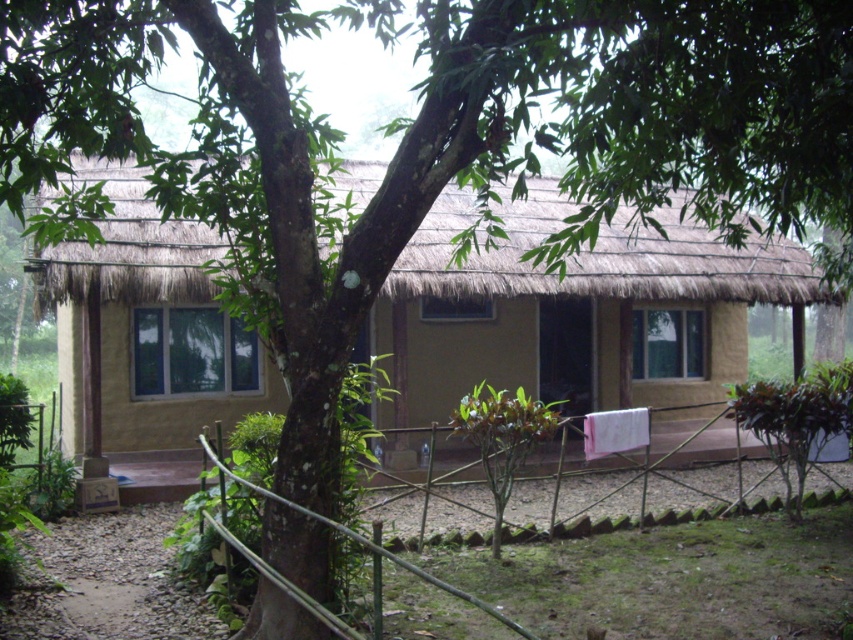
Is beige clay hut at center bigger than bamboo fence at lower center?

Yes.

Based on the photo, does beige clay hut at center have a lesser height compared to bamboo fence at lower center?

Incorrect, beige clay hut at center's height does not fall short of bamboo fence at lower center's.

Is point (117, 284) in front of point (506, 621)?

No.

At what (x,y) coordinates should I click in order to perform the action: click on beige clay hut at center. Please return your answer as a coordinate pair (x, y). Image resolution: width=853 pixels, height=640 pixels. Looking at the image, I should click on (575, 310).